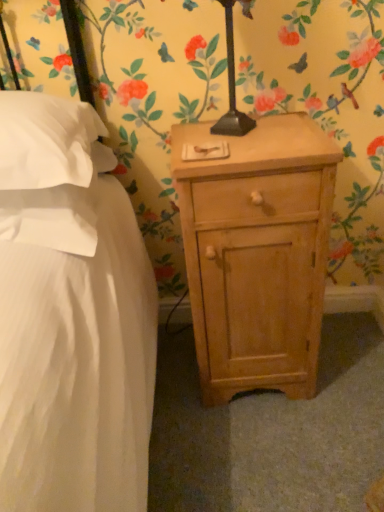
Where is `blank space situated above light wood nightstand at lower right (from a real-world perspective)`? blank space situated above light wood nightstand at lower right (from a real-world perspective) is located at coordinates (255, 137).